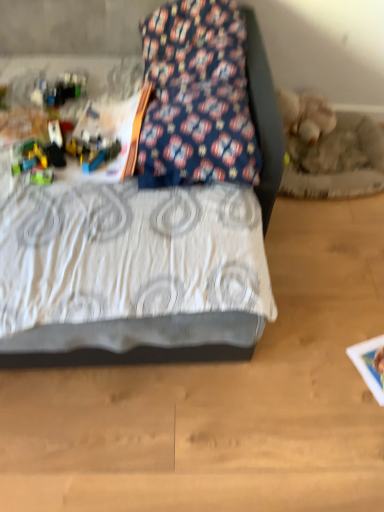
Question: From a real-world perspective, is white textured bed at center above or below floral fabric pillow at upper center?

Choices:
 (A) above
 (B) below

Answer: (B)

Question: In terms of height, does white textured bed at center look taller or shorter compared to floral fabric pillow at upper center?

Choices:
 (A) tall
 (B) short

Answer: (A)

Question: Which object is positioned closest to the white textured bed at center?

Choices:
 (A) floral fabric pillow at upper center
 (B) translucent plastic blocks at left

Answer: (B)

Question: Which object is the closest to the white textured bed at center?

Choices:
 (A) translucent plastic blocks at left
 (B) floral fabric pillow at upper center

Answer: (A)